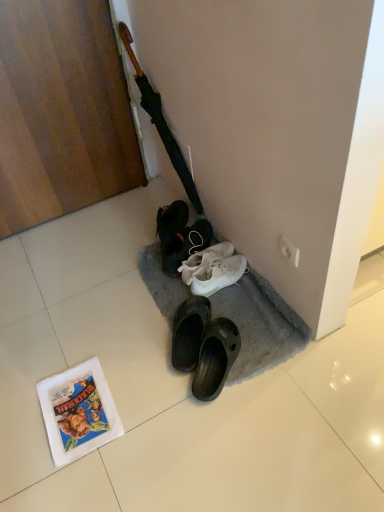
Question: From their relative heights in the image, would you say white paper comic book at lower left is taller or shorter than white plastic power outlet at upper right?

Choices:
 (A) short
 (B) tall

Answer: (A)

Question: From the image's perspective, is white paper comic book at lower left located above or below white plastic power outlet at upper right?

Choices:
 (A) above
 (B) below

Answer: (B)

Question: From a real-world perspective, is white paper comic book at lower left physically located above or below white plastic power outlet at upper right?

Choices:
 (A) below
 (B) above

Answer: (A)

Question: Would you say white plastic power outlet at upper right is to the left or to the right of white paper comic book at lower left in the picture?

Choices:
 (A) left
 (B) right

Answer: (B)

Question: Is white plastic power outlet at upper right situated inside white paper comic book at lower left or outside?

Choices:
 (A) inside
 (B) outside

Answer: (B)

Question: From the image's perspective, is white plastic power outlet at upper right located above or below white paper comic book at lower left?

Choices:
 (A) above
 (B) below

Answer: (A)

Question: Is white plastic power outlet at upper right in front of or behind white paper comic book at lower left in the image?

Choices:
 (A) front
 (B) behind

Answer: (B)